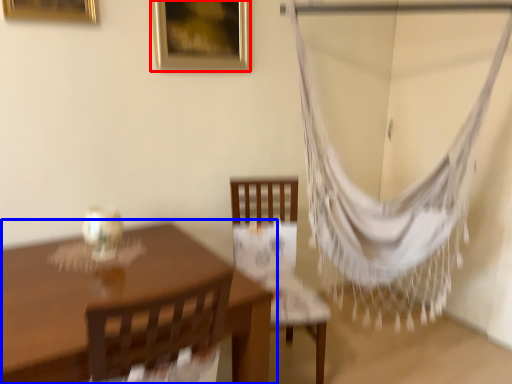
Question: Which object is further to the camera taking this photo, picture frame (highlighted by a red box) or table (highlighted by a blue box)?

Choices:
 (A) picture frame
 (B) table

Answer: (A)